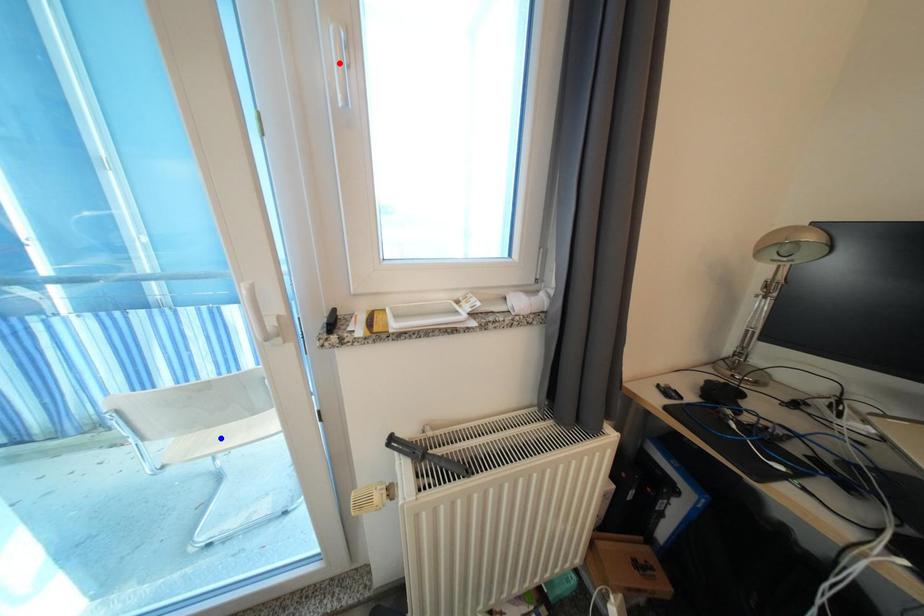
Question: In the image, two points are highlighted. Which point is nearer to the camera? Reply with the corresponding letter.

Choices:
 (A) blue point
 (B) red point

Answer: (B)